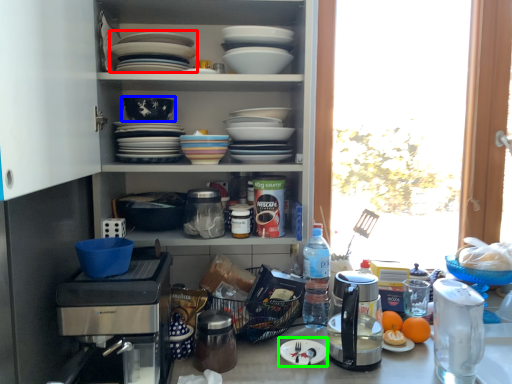
Question: Which object is positioned farthest from platter (highlighted by a red box)? Select from bowl (highlighted by a blue box) and paper plate (highlighted by a green box).

Choices:
 (A) bowl
 (B) paper plate

Answer: (B)